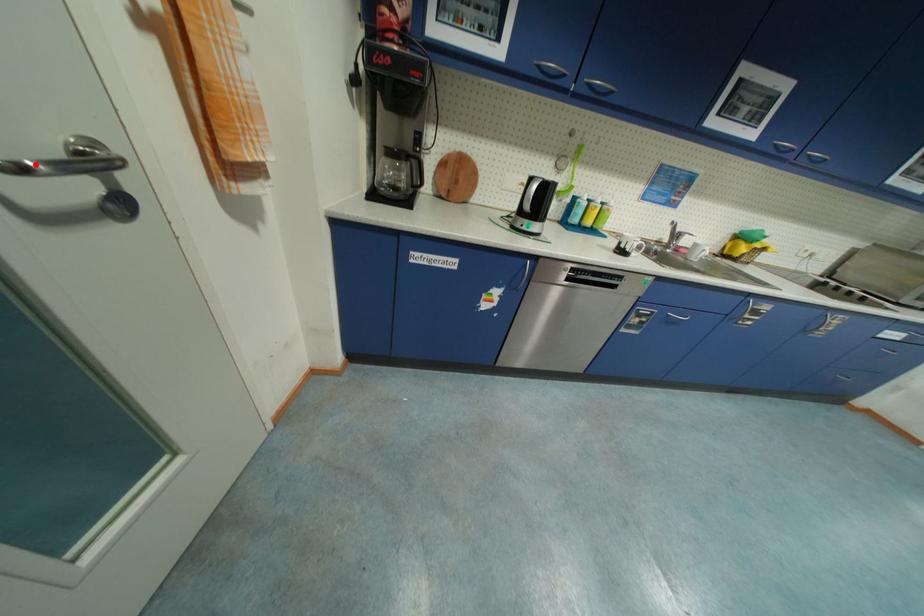
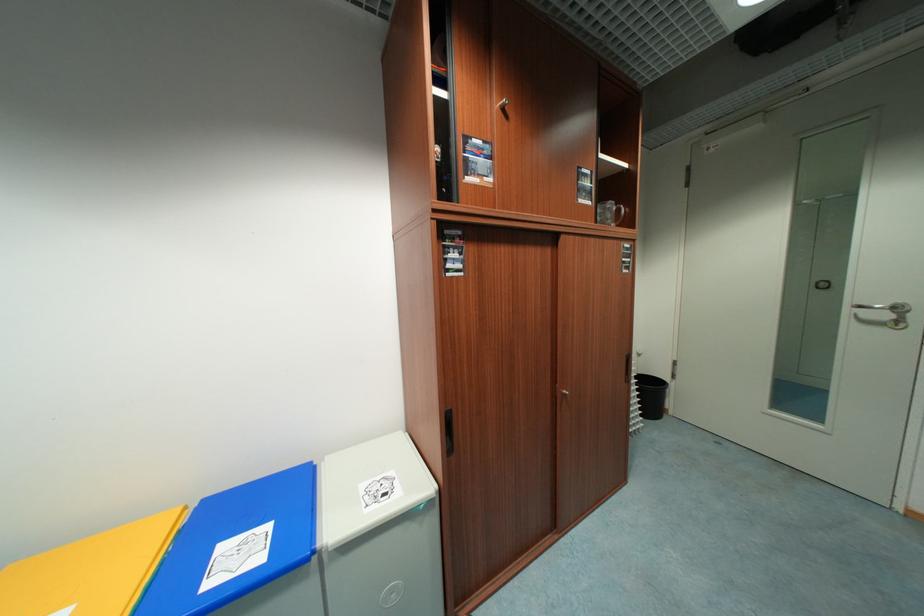
Question: I am providing you with two images of the same scene from different viewpoints. A red point is marked on the first image. Is the red point's position out of view in image 2?

Choices:
 (A) Yes
 (B) No

Answer: (A)